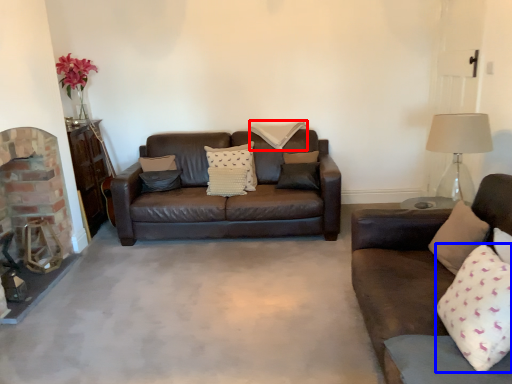
Question: Among these objects, which one is farthest to the camera, pillow (highlighted by a red box) or pillow (highlighted by a blue box)?

Choices:
 (A) pillow
 (B) pillow

Answer: (A)